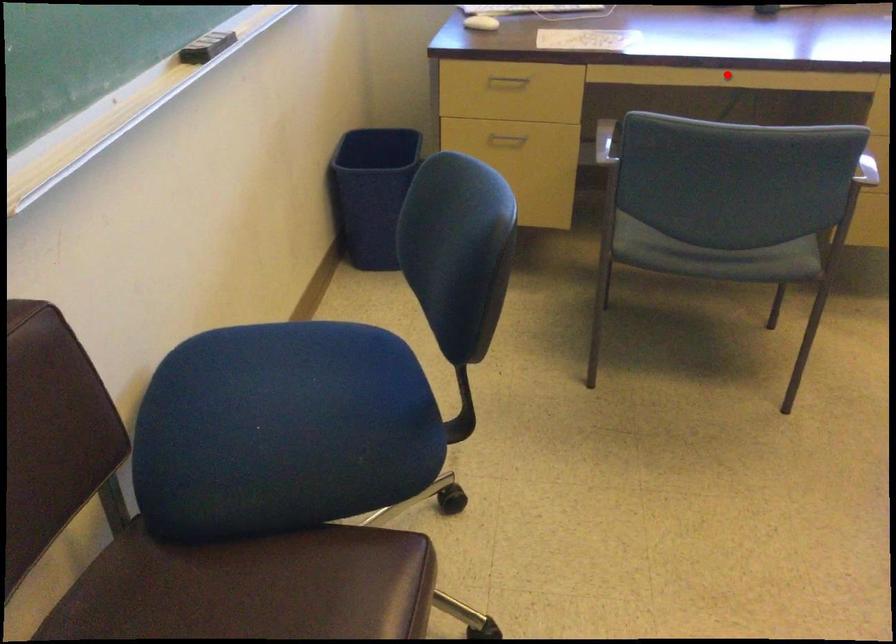
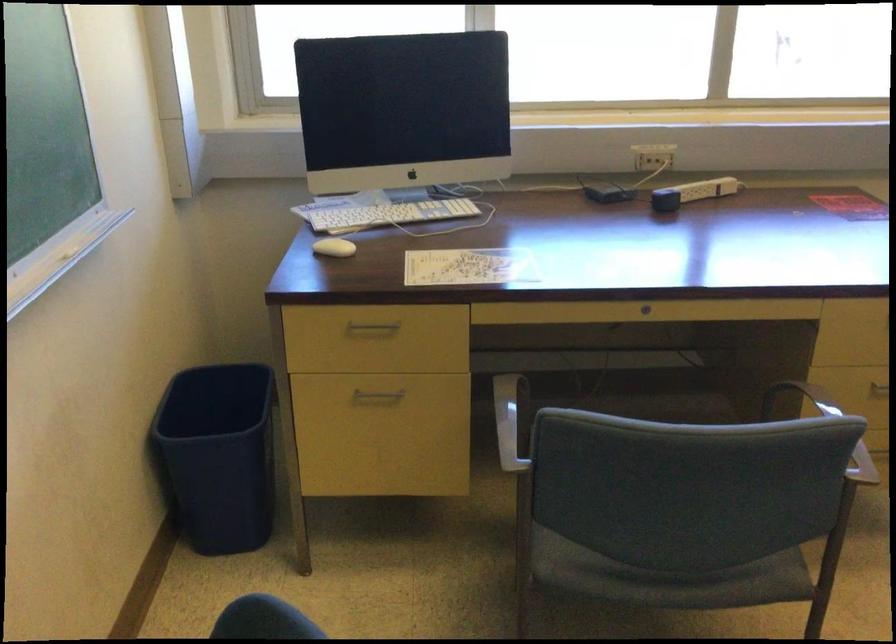
Question: A red point is marked in image1. In image2, is the corresponding 3D point closer to the camera or farther? Reply with the corresponding letter.

Choices:
 (A) The corresponding 3D point is closer.
 (B) The corresponding 3D point is farther.

Answer: (A)